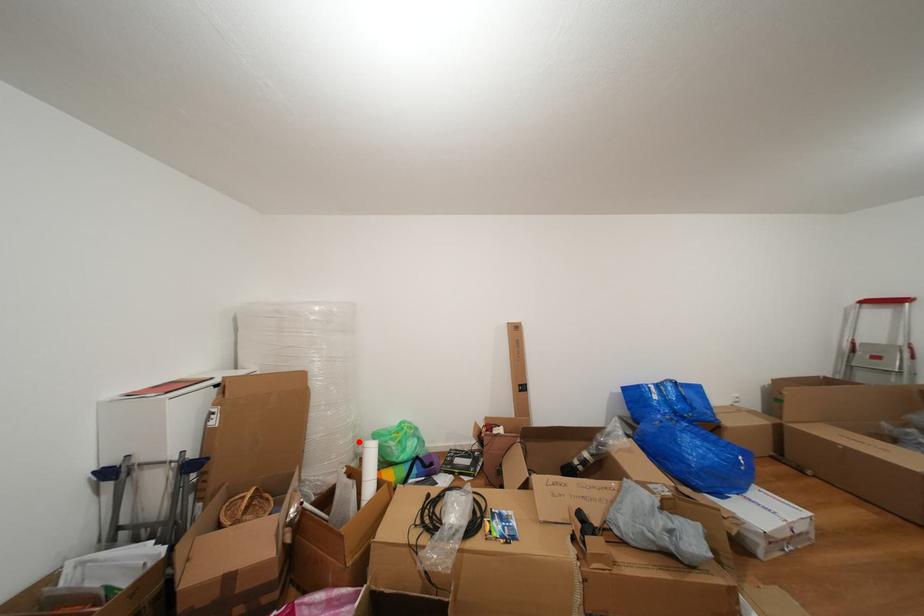
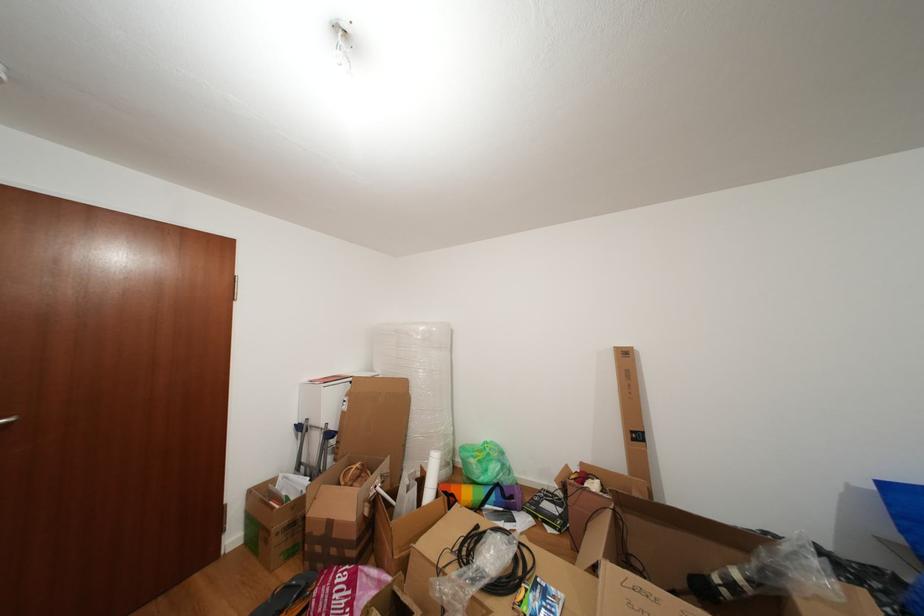
Question: I am providing you with two images of the same scene from different viewpoints. Image1 has a red point marked. In image2, the corresponding 3D location appears at what relative position? Reply with the corresponding letter.

Choices:
 (A) Closer
 (B) Farther

Answer: (B)